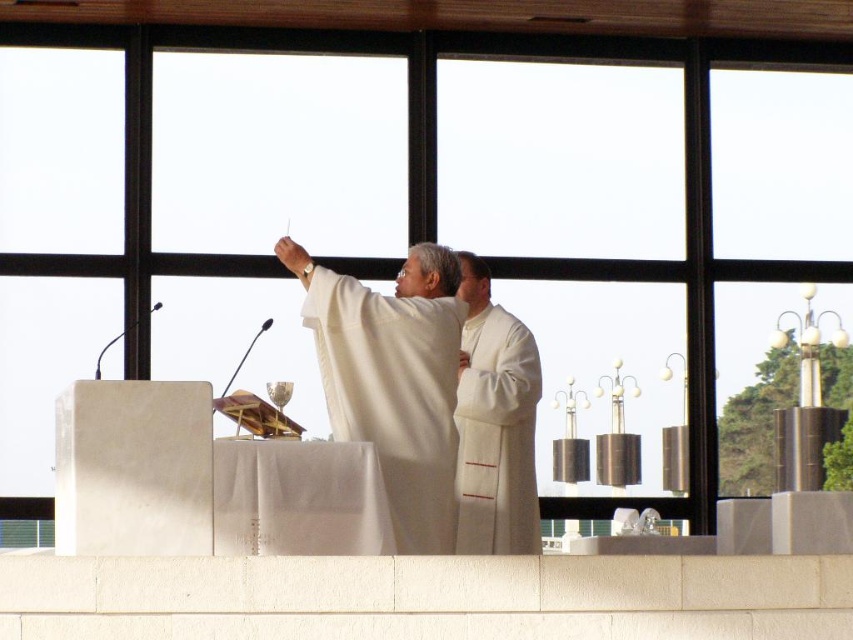
You are standing in the room where the two individuals are. The white matte robe at center is represented by point (x=393, y=392). If you want to move towards the white matte robe at center, which direction should you walk?

The white matte robe at center is located at point (x=393, y=392), so you should walk towards that coordinate to reach it.

You are standing in the ceremonial area and need to place a small offering. There are two points marked at coordinates point (392, 497) and point (514, 451). Which point is closer to you where you can place the offering without moving?

Point (392, 497) is closer to the viewer than point (514, 451), so you can place the offering there without moving.

Based on the photo, you are a photographer positioned at the entrance of the room. You need to capture a clear photo of both the white matte robe at center and the white silk robe at center. Which robe should you focus on first to ensure it appears sharp in the photo?

You should focus on the white matte robe at center first because it is in front of the white silk robe at center, so it will be closer to the camera and thus appear sharper in the photo.